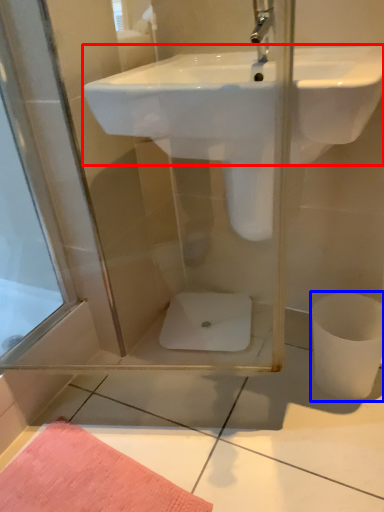
Question: Which of the following is the closest to the observer, sink (highlighted by a red box) or toilet bowl (highlighted by a blue box)?

Choices:
 (A) sink
 (B) toilet bowl

Answer: (A)